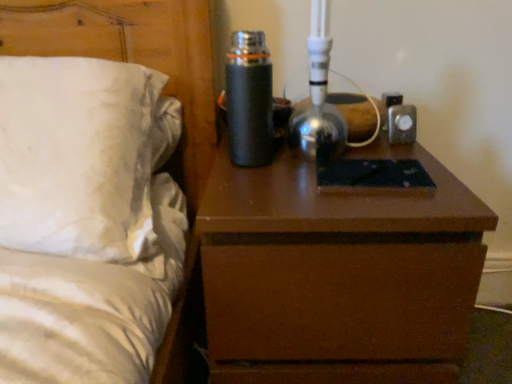
Image resolution: width=512 pixels, height=384 pixels. What are the coordinates of `unoccupied region to the right of black matte thermos at upper center` in the screenshot? It's located at (348, 157).